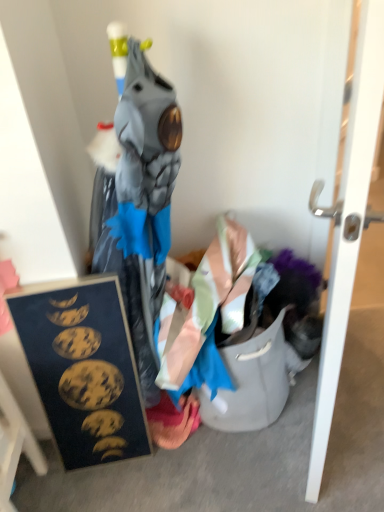
Identify the location of free space to the right of pink fabric at lower center. (224, 440).